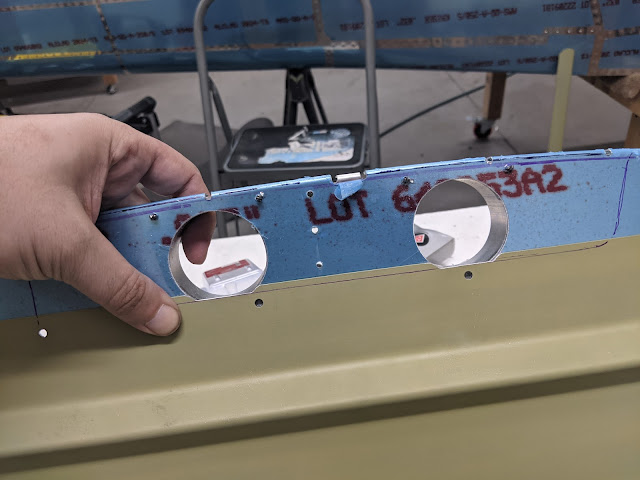
Image resolution: width=640 pixels, height=480 pixels. What are the coordinates of `stepping stool` in the screenshot? It's located at (371, 127).